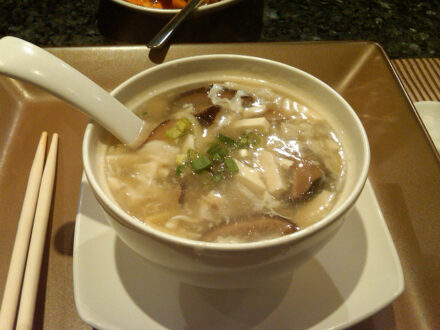
Locate an element on the screen. This screenshot has height=330, width=440. table is located at coordinates (369, 121).